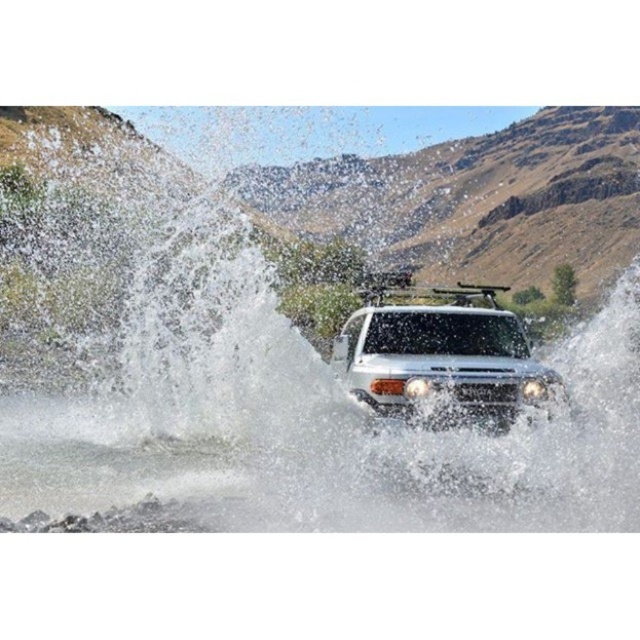
You are a photographer trying to capture the white frothy water at center and the white matte jeep at center in a single shot. Based on their positions, which object should you focus on first to ensure both are in frame?

The white frothy water at center is above the white matte jeep at center, so you should focus on the white matte jeep at center first to ensure both are in frame.

You are a photographer trying to capture the white matte jeep at center and the white frothy water at center in a single frame. Based on their positions, which object should you focus on first to ensure both are in the frame?

Since the white frothy water at center is to the left of the white matte jeep at center, you should focus on the white matte jeep at center first to ensure both are in the frame.